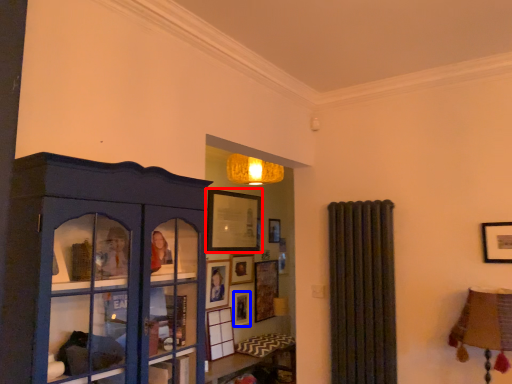
Question: Which object is further to the camera taking this photo, picture frame (highlighted by a red box) or picture frame (highlighted by a blue box)?

Choices:
 (A) picture frame
 (B) picture frame

Answer: (B)